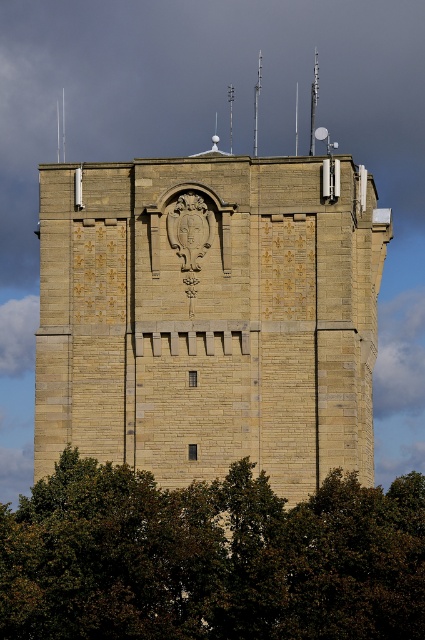
You are standing in front of the tower and want to take a photo of the green leafy tree at lower center. However, you notice the brown stone bell tower at center is blocking your view. Is the tree visible from your current position?

The brown stone bell tower at center is above the green leafy tree at lower center, so the tree is partially or fully obscured by the tower. Adjust your position to see the tree without obstruction.

You are an architect designing a new garden layout. You need to place a new statue that must be smaller than both the brown stone bell tower at center and the green leafy tree at lower center. Which object should you use as the reference for the maximum size of the statue?

The brown stone bell tower at center is bigger than the green leafy tree at lower center, so the statue should be smaller than the green leafy tree at lower center to ensure it is smaller than both.

You are standing at the base of the stone tower and looking up. You notice two points marked on the tower wall. The first point is located at coordinates point [329,200] and the second at point [175,524]. Which point appears closer to your eyes when viewed from your current position?

Point [329,200] is further to the camera than point [175,524], so the point [175,524] appears closer to your eyes.